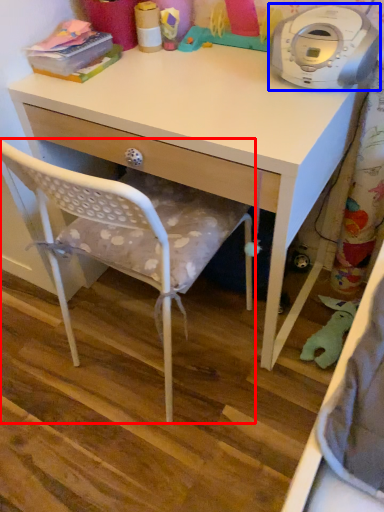
Question: Which of the following is the closest to the observer, chair (highlighted by a red box) or home appliance (highlighted by a blue box)?

Choices:
 (A) chair
 (B) home appliance

Answer: (A)